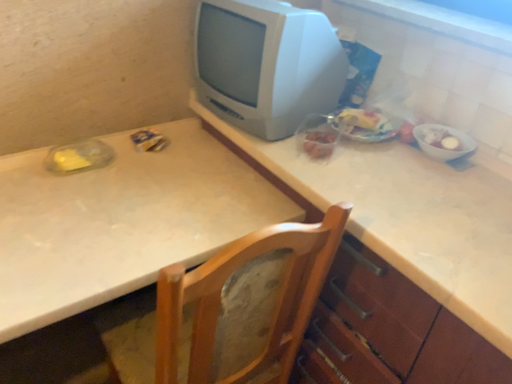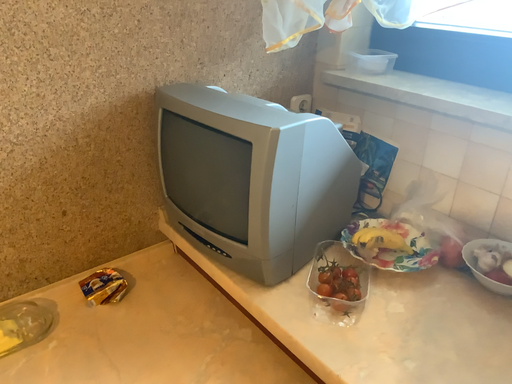
Question: How did the camera likely rotate when shooting the video?

Choices:
 (A) rotated downward
 (B) rotated upward

Answer: (B)